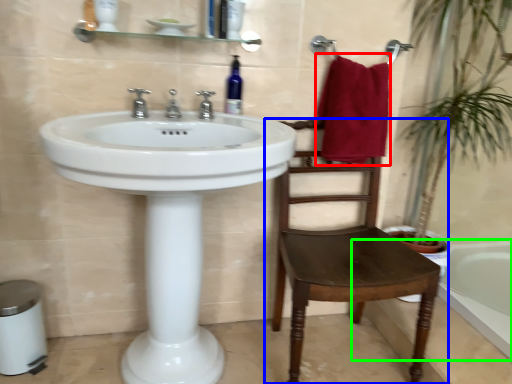
Question: Considering the real-world distances, which object is closest to bath towel (highlighted by a red box)? chair (highlighted by a blue box) or bath (highlighted by a green box).

Choices:
 (A) chair
 (B) bath

Answer: (A)